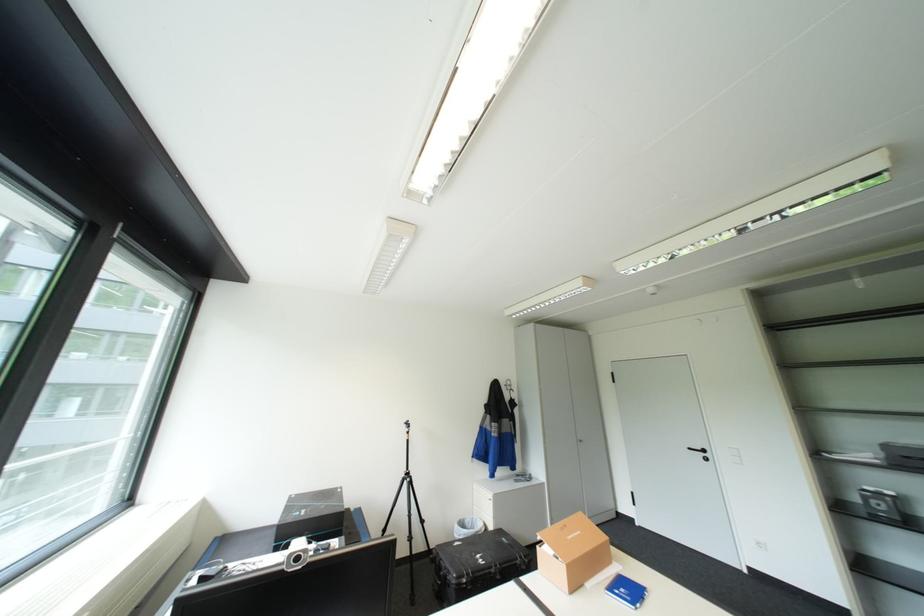
Identify the location of black door handle. (702, 455).